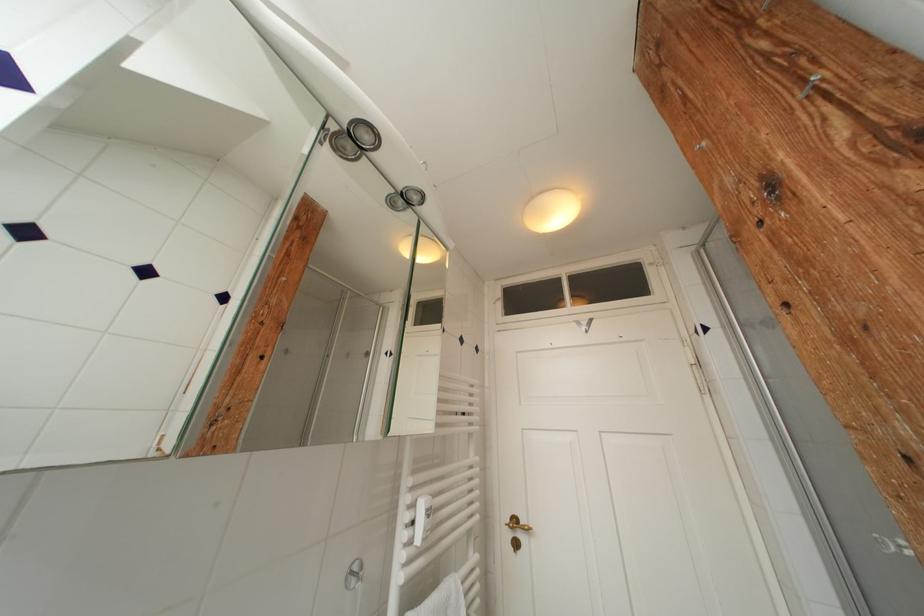
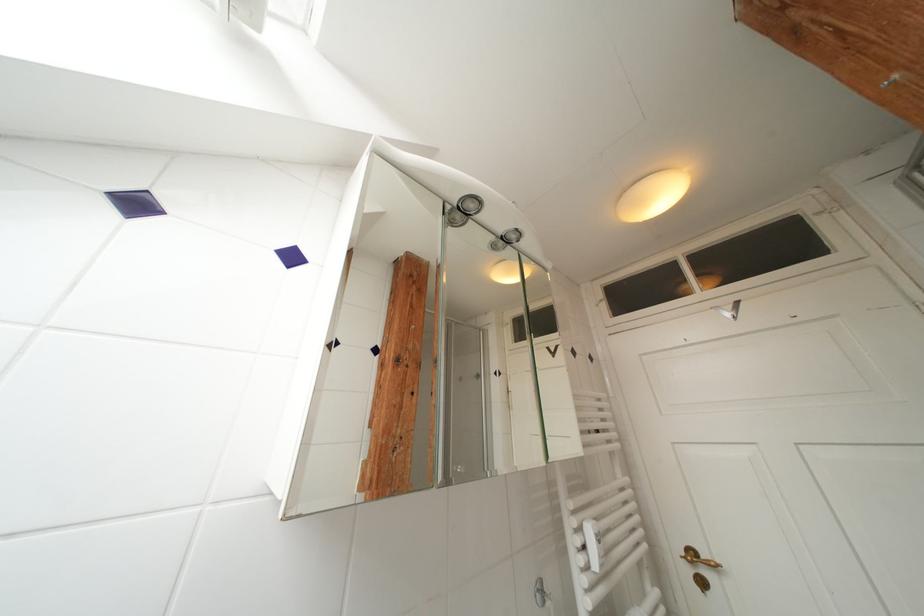
In the second image, find the point that corresponds to (419,511) in the first image.

(586, 533)